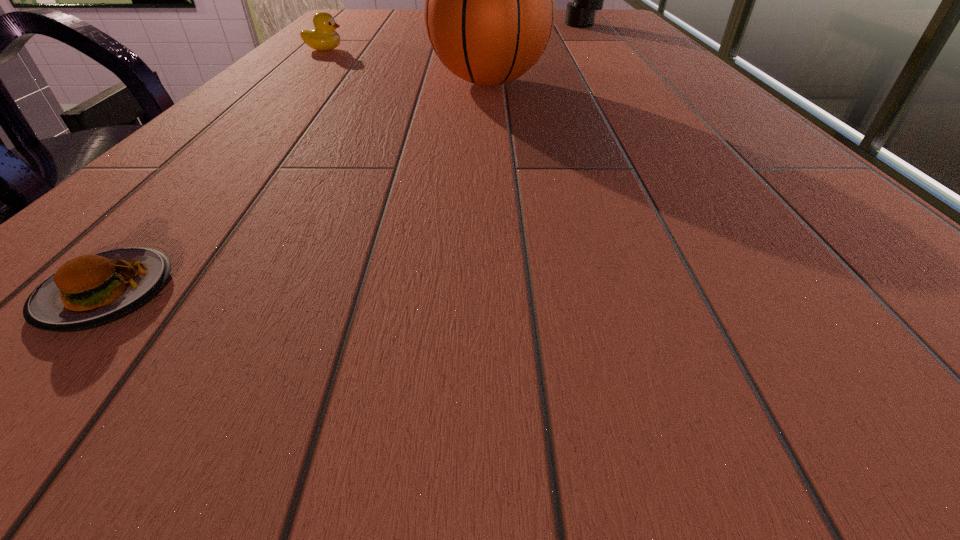
The width and height of the screenshot is (960, 540). What are the coordinates of `object that is positioned at the left edge` in the screenshot? It's located at (324, 37).

This screenshot has height=540, width=960. I want to click on object located at the right edge, so click(581, 12).

What are the coordinates of `object located at the far right corner` in the screenshot? It's located at (581, 12).

The image size is (960, 540). I want to click on vacant space at the left edge of the desktop, so coord(158,183).

This screenshot has height=540, width=960. In order to click on free spot at the right edge of the desktop in this screenshot , I will do `click(764, 179)`.

The image size is (960, 540). In the image, there is a desktop. Find the location of `vacant space at the far left corner`. vacant space at the far left corner is located at coordinates tap(373, 21).

Locate an element on the screen. free spot at the near left corner of the desktop is located at coordinates (41, 369).

This screenshot has height=540, width=960. I want to click on free space at the far right corner, so pos(600,11).

Image resolution: width=960 pixels, height=540 pixels. In order to click on free point between the third nearest object and the basketball in this screenshot , I will do `click(406, 66)`.

I want to click on object that can be found as the closest to the rightmost object, so click(x=489, y=12).